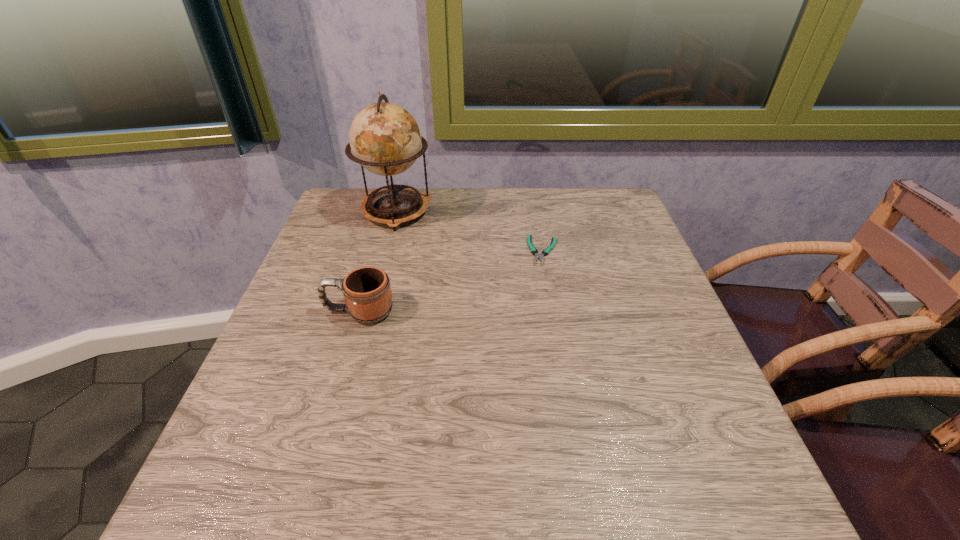
Locate an element on the screen. This screenshot has width=960, height=540. empty location between the tallest object and the second nearest object is located at coordinates (469, 231).

Where is `empty space that is in between the globe and the mug`? The height and width of the screenshot is (540, 960). empty space that is in between the globe and the mug is located at coordinates (377, 261).

Where is `free space that is in between the farthest object and the mug`? The image size is (960, 540). free space that is in between the farthest object and the mug is located at coordinates (377, 261).

You are a GUI agent. You are given a task and a screenshot of the screen. Output one action in this format:
    pyautogui.click(x=<x>, y=<y>)
    Task: Click on the free space between the pliers and the mug
    Image resolution: width=960 pixels, height=540 pixels.
    Given the screenshot: What is the action you would take?
    pyautogui.click(x=451, y=281)

The image size is (960, 540). In order to click on unoccupied position between the globe and the pliers in this screenshot , I will do `click(469, 231)`.

Image resolution: width=960 pixels, height=540 pixels. What are the coordinates of `unoccupied position between the nearest object and the globe` in the screenshot? It's located at (377, 261).

At what (x,y) coordinates should I click in order to perform the action: click on empty space between the pliers and the globe. Please return your answer as a coordinate pair (x, y). Looking at the image, I should click on (469, 231).

Where is `free space between the second shortest object and the tallest object`? The image size is (960, 540). free space between the second shortest object and the tallest object is located at coordinates point(377,261).

At what (x,y) coordinates should I click in order to perform the action: click on the closest object to the nearest object. Please return your answer as a coordinate pair (x, y). This screenshot has width=960, height=540. Looking at the image, I should click on 385,139.

Identify which object is located as the second nearest to the tallest object. Please provide its 2D coordinates. Your answer should be formatted as a tuple, i.e. [(x, y)], where the tuple contains the x and y coordinates of a point satisfying the conditions above.

[(534, 251)]